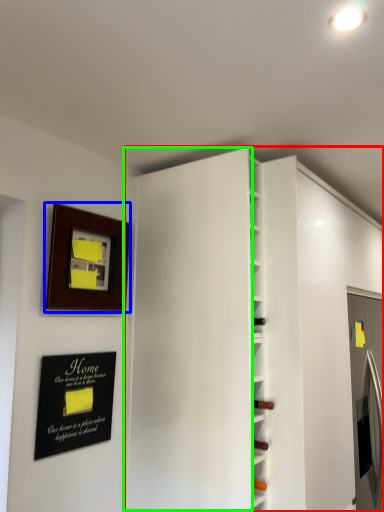
Question: Based on their relative distances, which object is nearer to bookshelf (highlighted by a red box)? Choose from picture frame (highlighted by a blue box) and door (highlighted by a green box).

Choices:
 (A) picture frame
 (B) door

Answer: (B)